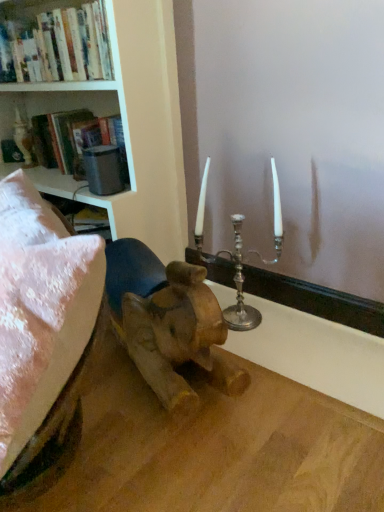
Question: Is matte black bookshelf at upper left wider or thinner than hardcover books at upper left?

Choices:
 (A) thin
 (B) wide

Answer: (B)

Question: From a real-world perspective, relative to hardcover books at upper left, is matte black bookshelf at upper left vertically above or below?

Choices:
 (A) below
 (B) above

Answer: (A)

Question: Estimate the real-world distances between objects in this image. Which object is farther from the silver metallic candle holder at center?

Choices:
 (A) matte black bookshelf at upper left
 (B) silver metallic candlestick at upper center
 (C) white painted wood bookcase at upper left
 (D) hardcover books at upper left

Answer: (D)

Question: Considering the real-world distances, which object is farthest from the white painted wood bookcase at upper left?

Choices:
 (A) hardcover books at upper left
 (B) silver metallic candlestick at upper center
 (C) silver metallic candle holder at center
 (D) matte black bookshelf at upper left

Answer: (B)